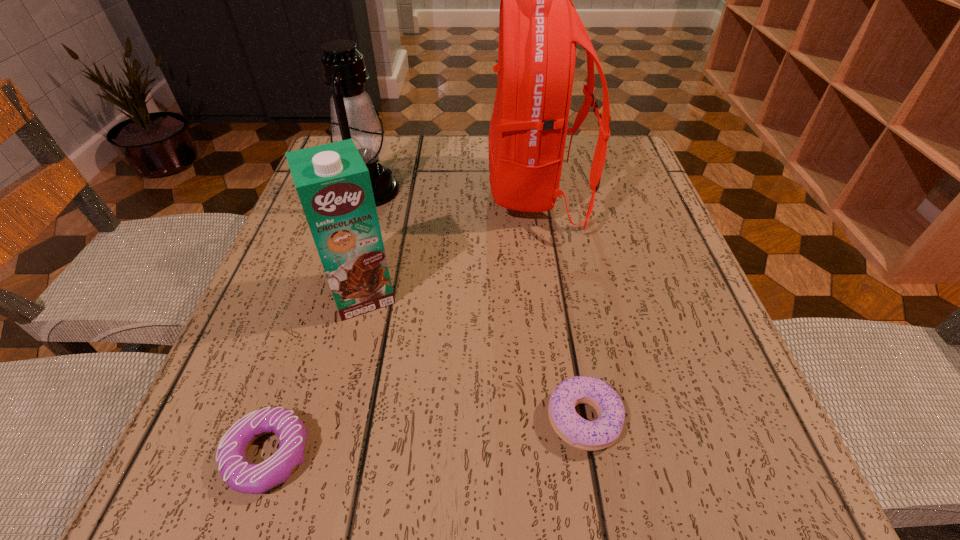
The image size is (960, 540). In order to click on free space that satisfies the following two spatial constraints: 1. on the main compartment of the tallest object; 2. on the right side of the right doughnut in this screenshot , I will do `click(570, 419)`.